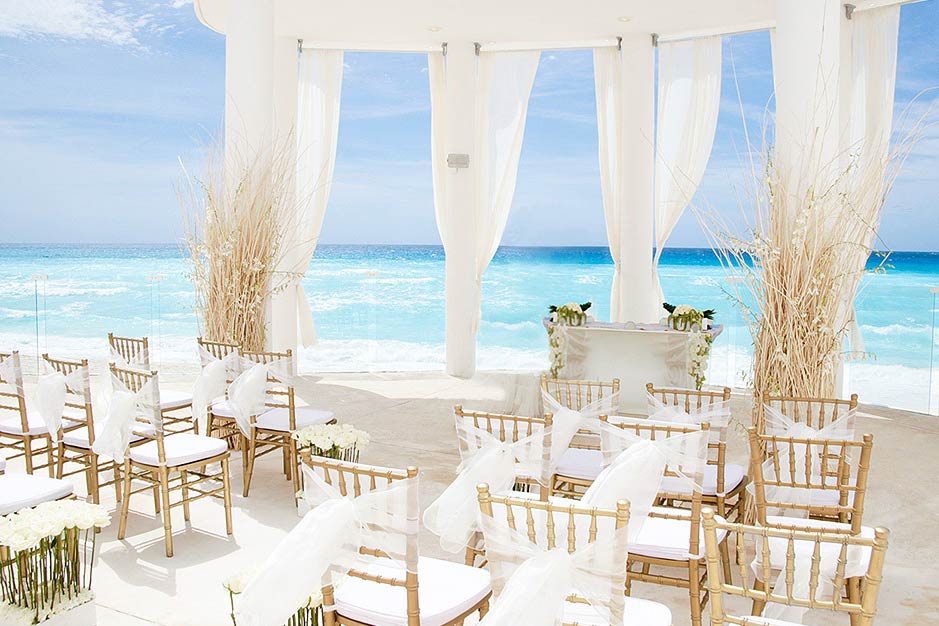
In order to click on curtains in this screenshot , I will do [480, 212], [619, 193], [837, 160].